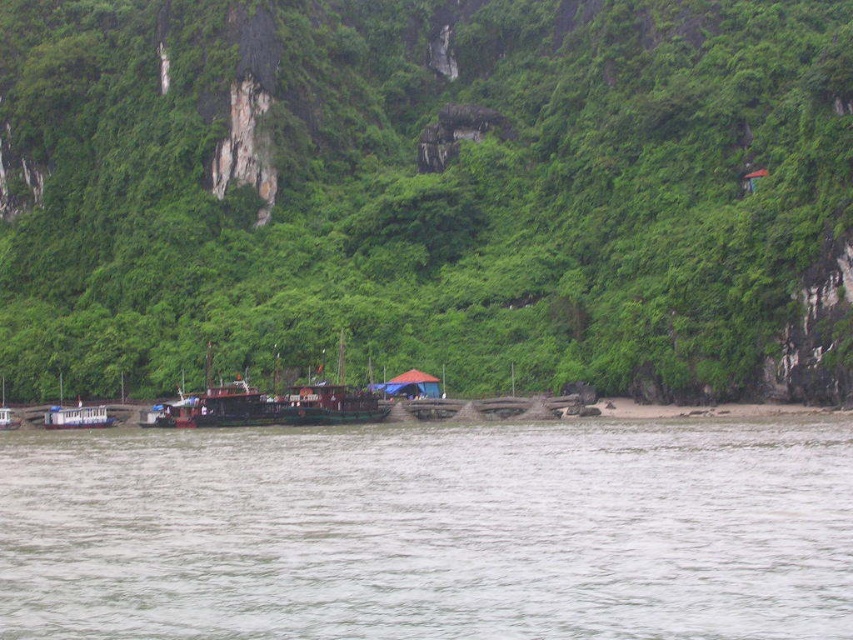
Question: Does green leafy vegetation at center appear over wooden boat at lower left?

Choices:
 (A) no
 (B) yes

Answer: (B)

Question: Is gray matte water at lower center to the left of red fabric tent at center from the viewer's perspective?

Choices:
 (A) yes
 (B) no

Answer: (B)

Question: Which is nearer to the gray matte water at lower center?

Choices:
 (A) red fabric tent at center
 (B) wooden boat at lower left
 (C) green leafy vegetation at center

Answer: (A)

Question: Which point appears closest to the camera in this image?

Choices:
 (A) (88, 412)
 (B) (250, 337)

Answer: (A)

Question: Which point is closer to the camera taking this photo?

Choices:
 (A) click(65, 412)
 (B) click(251, 566)
 (C) click(248, 19)

Answer: (B)

Question: Does green leafy vegetation at center have a smaller size compared to wooden boat at lower left?

Choices:
 (A) no
 (B) yes

Answer: (A)